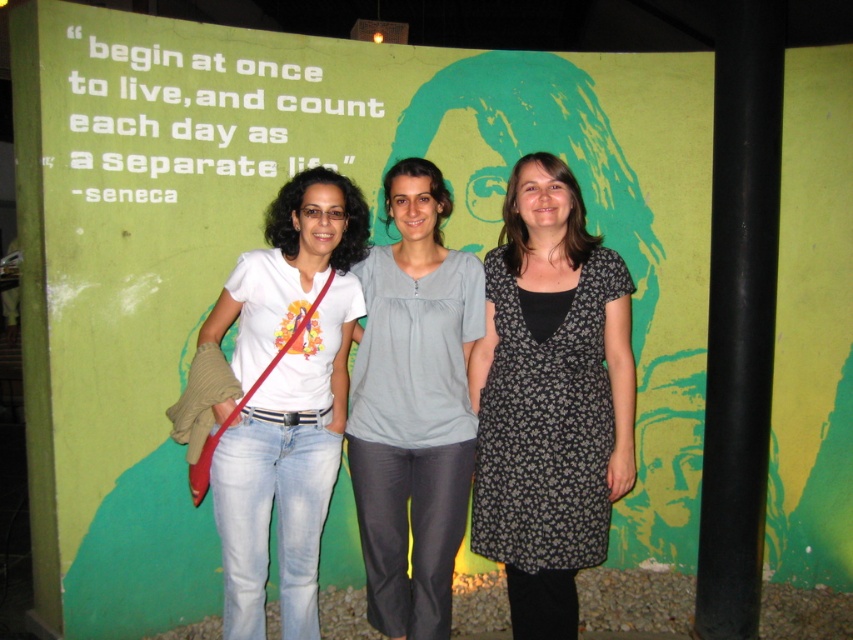
Between black floral dress at center and white cotton t-shirt at center, which one appears on the right side from the viewer's perspective?

From the viewer's perspective, black floral dress at center appears more on the right side.

Which of these two, black floral dress at center or white cotton t-shirt at center, stands shorter?

black floral dress at center

Is point (561, 337) positioned in front of point (341, 205)?

Yes, point (561, 337) is in front of point (341, 205).

Locate an element on the screen. The width and height of the screenshot is (853, 640). black floral dress at center is located at coordinates (550, 397).

Can you confirm if light gray cotton blouse at center is positioned below white cotton t-shirt at center?

Indeed, light gray cotton blouse at center is positioned under white cotton t-shirt at center.

Which is behind, point (465, 387) or point (219, 316)?

Point (465, 387)

Between point (447, 522) and point (335, 218), which one is positioned in front?

Positioned in front is point (335, 218).

Where is `light gray cotton blouse at center`? light gray cotton blouse at center is located at coordinates (413, 406).

Can you confirm if black floral dress at center is positioned below light gray cotton blouse at center?

No.

Is black floral dress at center in front of light gray cotton blouse at center?

Yes, black floral dress at center is closer to the viewer.

Locate an element on the screen. The height and width of the screenshot is (640, 853). black floral dress at center is located at coordinates (550, 397).

Locate an element on the screen. The width and height of the screenshot is (853, 640). black floral dress at center is located at coordinates (550, 397).